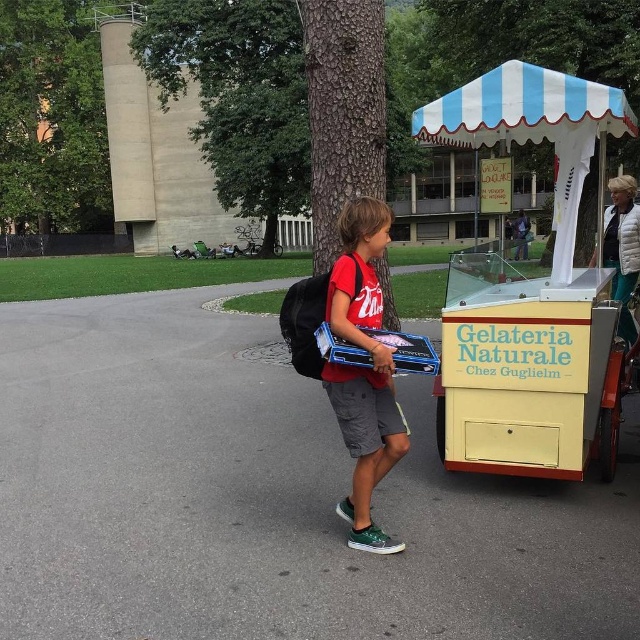
Question: Which object is the farthest from the yellow matte ice cream cart at right?

Choices:
 (A) white fabric umbrella at upper right
 (B) blue and white striped canopy at upper right

Answer: (A)

Question: Does blue and white striped canopy at upper right appear on the right side of matte red t-shirt at center?

Choices:
 (A) yes
 (B) no

Answer: (A)

Question: Is yellow matte ice cream cart at right bigger than white fabric umbrella at upper right?

Choices:
 (A) no
 (B) yes

Answer: (A)

Question: Is yellow matte ice cream cart at right above blue and white striped canopy at upper right?

Choices:
 (A) no
 (B) yes

Answer: (A)

Question: Which object is the farthest from the yellow matte ice cream cart at right?

Choices:
 (A) blue and white striped canopy at upper right
 (B) matte red t-shirt at center
 (C) white fabric umbrella at upper right

Answer: (C)

Question: Which is nearer to the yellow matte ice cream cart at right?

Choices:
 (A) matte red t-shirt at center
 (B) blue and white striped canopy at upper right

Answer: (B)